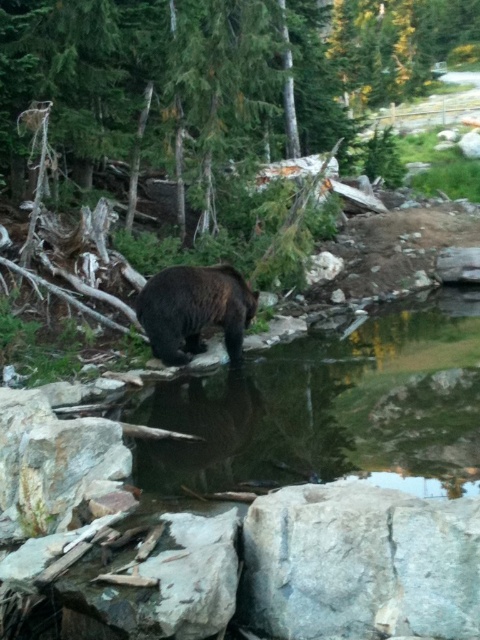
Question: Which object is farther from the camera taking this photo?

Choices:
 (A) green textured tree at center
 (B) gray rough rock at center
 (C) transparent water at center
 (D) brown furry bear at center

Answer: (A)

Question: Is green textured tree at center positioned at the back of gray rough rock at center?

Choices:
 (A) yes
 (B) no

Answer: (A)

Question: Which point is farther from the camera taking this photo?

Choices:
 (A) (203, 452)
 (B) (210, 282)
 (C) (259, 81)

Answer: (C)

Question: Can you confirm if green textured tree at center is wider than gray rough rock at center?

Choices:
 (A) no
 (B) yes

Answer: (B)

Question: Which object appears farthest from the camera in this image?

Choices:
 (A) transparent water at center
 (B) green textured tree at center
 (C) brown furry bear at center
 (D) gray rough rock at center

Answer: (B)

Question: Is green textured tree at center thinner than gray rough rock at center?

Choices:
 (A) no
 (B) yes

Answer: (A)